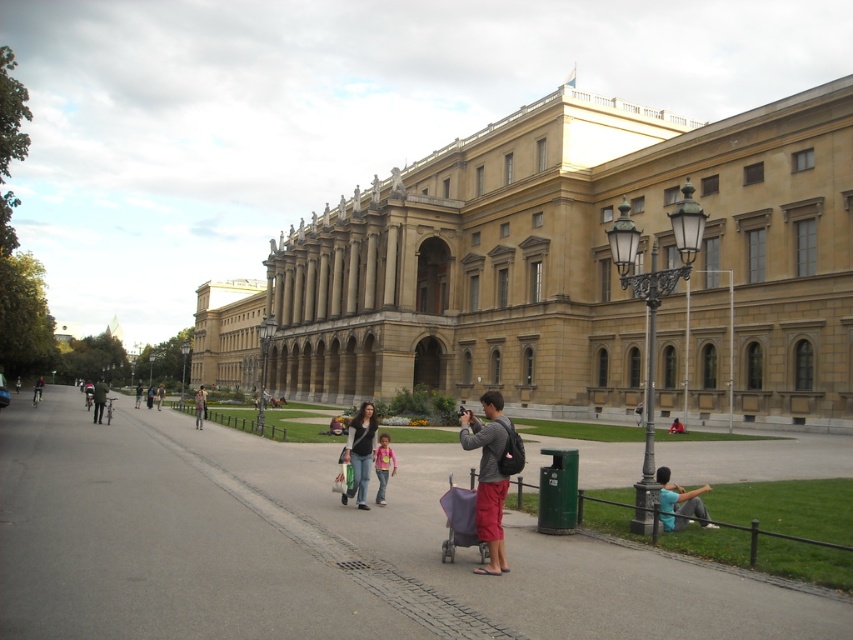
You are standing on the paved pathway in front of the grand classical building. You see the golden stone palace at center and the dark gray jacket at left. Which object is positioned more to the right side?

The golden stone palace at center is positioned more to the right side than the dark gray jacket at left.

You are standing on the paved pathway in front of the golden stone palace at center and the dark gray jacket at left. Which object is taller?

The golden stone palace at center is taller than the dark gray jacket at left.

You are standing at the entrance of the grand classical building and want to reach the gray asphalt pavement at center. Which direction should you walk to reach it?

The gray asphalt pavement at center is located at point (312, 548). Since this coordinate is in the lower part of the image, you should walk forward towards the center of the image to reach the gray asphalt pavement at center.